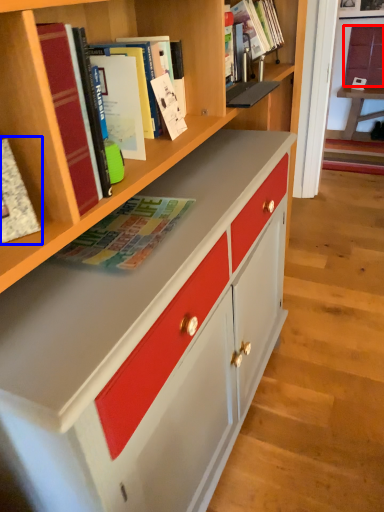
Question: Which object is closer to the camera taking this photo, cabinetry (highlighted by a red box) or book (highlighted by a blue box)?

Choices:
 (A) cabinetry
 (B) book

Answer: (B)